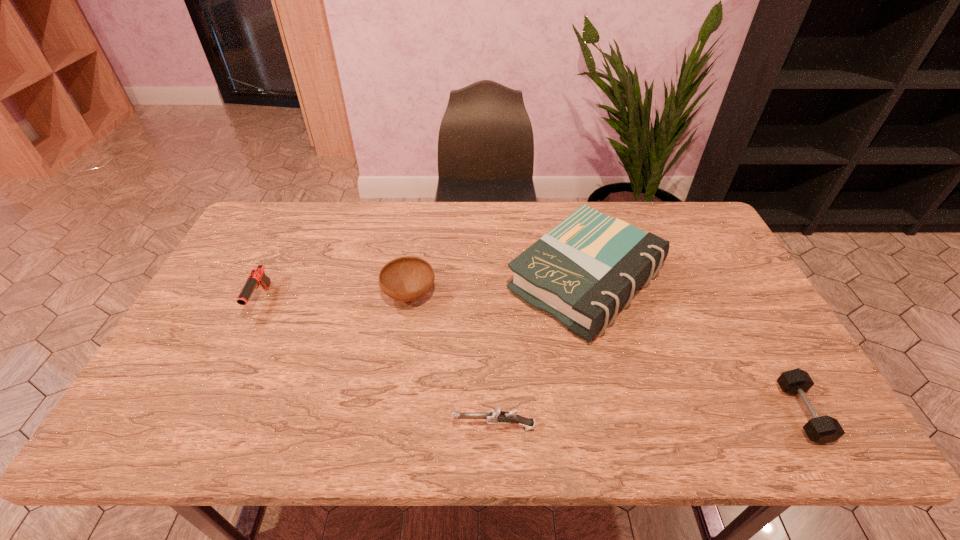
The width and height of the screenshot is (960, 540). I want to click on vacant area located 0.380m on the right of the bowl, so click(x=566, y=295).

What are the coordinates of `free space located 0.390m aimed along the barrel of the right gun` in the screenshot? It's located at (280, 427).

Image resolution: width=960 pixels, height=540 pixels. What are the coordinates of `free space located aimed along the barrel of the right gun` in the screenshot? It's located at (422, 427).

Locate an element on the screen. Image resolution: width=960 pixels, height=540 pixels. vacant space located 0.330m aimed along the barrel of the right gun is located at coordinates (307, 427).

This screenshot has width=960, height=540. Find the location of `vacant space located on the left of the shortest object`. vacant space located on the left of the shortest object is located at coordinates (636, 413).

You are a GUI agent. You are given a task and a screenshot of the screen. Output one action in this format:
    pyautogui.click(x=<x>, y=<y>)
    Task: Click on the object located at the far edge
    The image size is (960, 540).
    Given the screenshot: What is the action you would take?
    pyautogui.click(x=583, y=271)

Identify the location of gun at the near edge. (496, 416).

Identify the location of dumbbell that is at the near edge. Image resolution: width=960 pixels, height=540 pixels. (825, 429).

At what (x,y) coordinates should I click in order to perform the action: click on object that is at the left edge. Please return your answer as a coordinate pair (x, y). The width and height of the screenshot is (960, 540). Looking at the image, I should click on (257, 277).

Where is `object that is at the right edge`? The image size is (960, 540). object that is at the right edge is located at coordinates (825, 429).